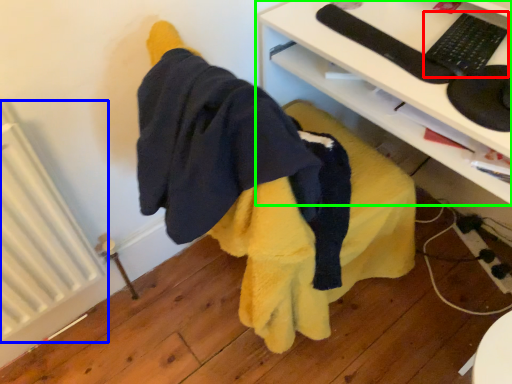
Question: Based on their relative distances, which object is nearer to keyboard (highlighted by a red box)? Choose from radiator (highlighted by a blue box) and desk (highlighted by a green box).

Choices:
 (A) radiator
 (B) desk

Answer: (B)